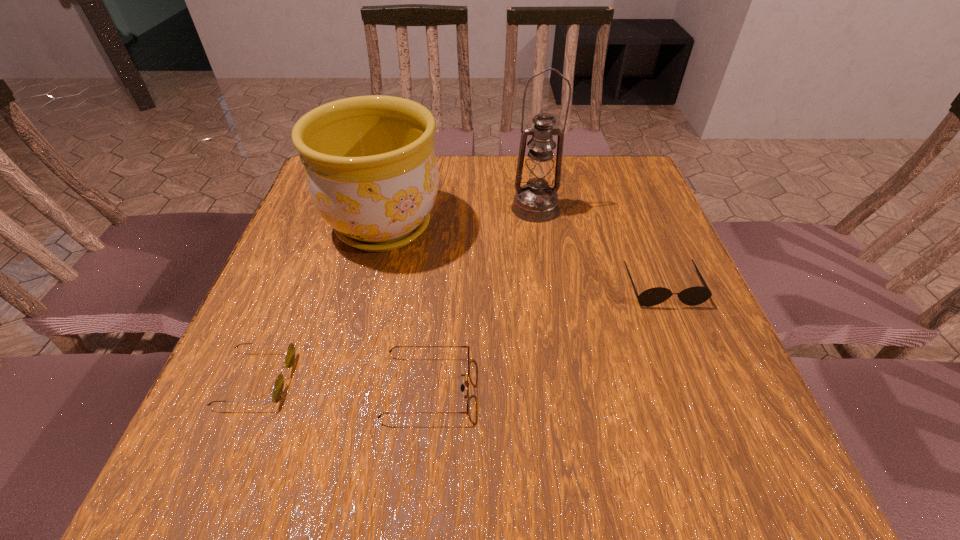
Where is `free region at the left edge of the desktop`? This screenshot has width=960, height=540. free region at the left edge of the desktop is located at coordinates (353, 253).

At what (x,y) coordinates should I click in order to perform the action: click on vacant space at the right edge of the desktop. Please return your answer as a coordinate pair (x, y). The height and width of the screenshot is (540, 960). Looking at the image, I should click on (654, 363).

Where is `vacant area at the far left corner`? The image size is (960, 540). vacant area at the far left corner is located at coordinates (311, 198).

Identify the location of vacant position at the far right corner of the desktop. tap(640, 200).

Find the location of a particular element. The image size is (960, 540). vacant area at the near right corner is located at coordinates (724, 435).

Locate an element on the screen. The height and width of the screenshot is (540, 960). free space that is in between the leftmost sunglasses and the third tallest object is located at coordinates (459, 333).

Where is `unoccupied position between the leftmost sunglasses and the rightmost sunglasses`? unoccupied position between the leftmost sunglasses and the rightmost sunglasses is located at coordinates (459, 333).

Locate an element on the screen. This screenshot has height=540, width=960. free space between the rightmost sunglasses and the leftmost sunglasses is located at coordinates (459, 333).

Identify the location of vacant area between the farthest sunglasses and the fourth shortest object. (523, 256).

Where is `vacant area that lies between the leftmost sunglasses and the second sunglasses from left to right`? This screenshot has width=960, height=540. vacant area that lies between the leftmost sunglasses and the second sunglasses from left to right is located at coordinates (342, 383).